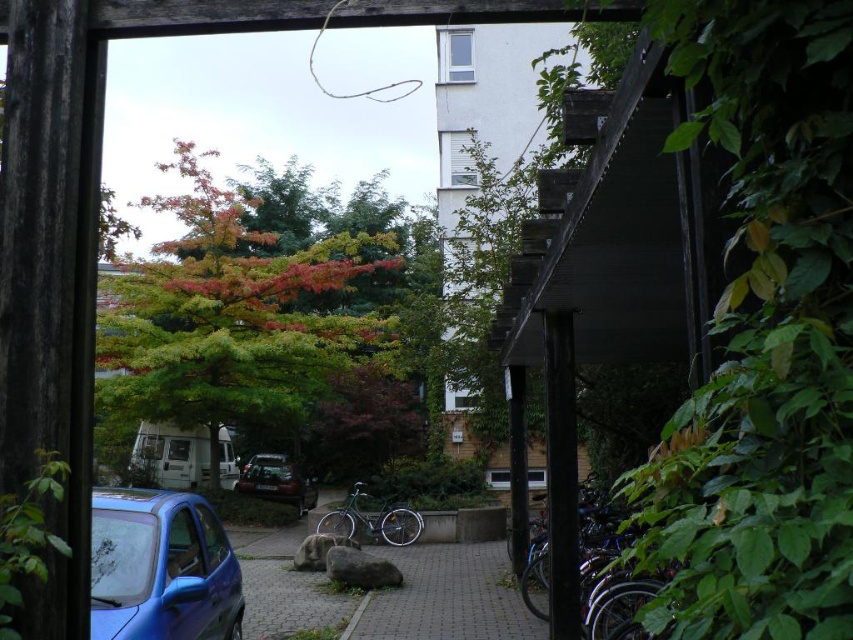
Between point (339, 525) and point (244, 486), which one is positioned in front?

Point (339, 525) is more forward.

Which is more to the left, shiny metallic bicycle at center or shiny dark gray car at center?

shiny dark gray car at center is more to the left.

Is point (357, 528) positioned after point (310, 481)?

No, (357, 528) is in front of (310, 481).

In order to click on shiny metallic bicycle at center in this screenshot , I will do `click(372, 518)`.

Can you confirm if shiny blue car at lower left is positioned above brick paved driveway at center?

Correct, shiny blue car at lower left is located above brick paved driveway at center.

Does shiny blue car at lower left come in front of brick paved driveway at center?

Yes, shiny blue car at lower left is closer to the viewer.

Who is more forward, (242, 605) or (480, 605)?

Point (242, 605)

Where is `shiny blue car at lower left`? The image size is (853, 640). shiny blue car at lower left is located at coordinates (161, 566).

Is shiny blue car at lower left positioned in front of shiny dark gray car at center?

Yes, shiny blue car at lower left is closer to the viewer.

Image resolution: width=853 pixels, height=640 pixels. What do you see at coordinates (161, 566) in the screenshot?
I see `shiny blue car at lower left` at bounding box center [161, 566].

Locate an element on the screen. The image size is (853, 640). shiny blue car at lower left is located at coordinates (161, 566).